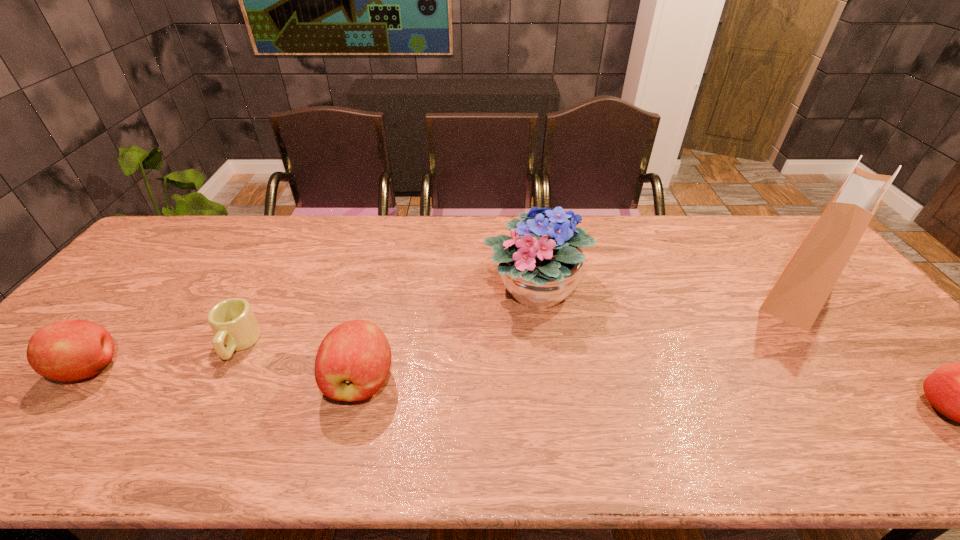
Locate an element on the screen. This screenshot has height=540, width=960. free region that satisfies the following two spatial constraints: 1. on the back side of the second apple from right to left; 2. on the right side of the tallest object is located at coordinates (382, 294).